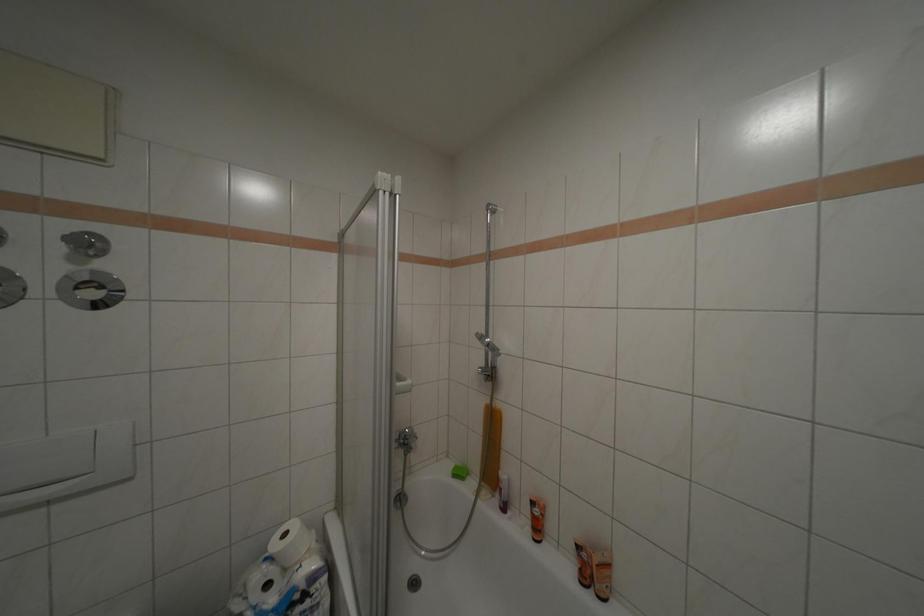
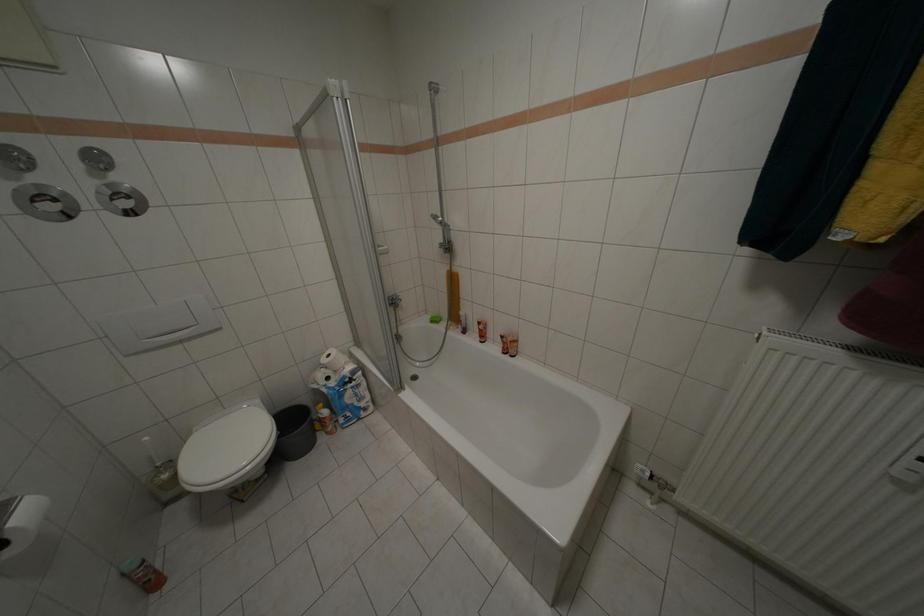
Question: In a continuous first-person perspective shot, in which direction is the camera moving?

Choices:
 (A) Left
 (B) Right
 (C) Forward
 (D) Backward

Answer: (D)